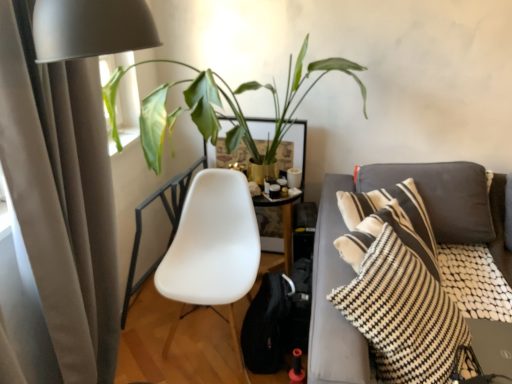
Question: Is beige fabric curtain at left closer to the viewer compared to black and white striped pillow at right?

Choices:
 (A) no
 (B) yes

Answer: (B)

Question: Can you confirm if beige fabric curtain at left is shorter than black and white striped pillow at right?

Choices:
 (A) no
 (B) yes

Answer: (A)

Question: Is beige fabric curtain at left behind black and white striped pillow at right?

Choices:
 (A) no
 (B) yes

Answer: (A)

Question: Is beige fabric curtain at left completely or partially outside of black and white striped pillow at right?

Choices:
 (A) yes
 (B) no

Answer: (A)

Question: From the image's perspective, does beige fabric curtain at left appear higher than black and white striped pillow at right?

Choices:
 (A) no
 (B) yes

Answer: (B)

Question: From a real-world perspective, is beige fabric curtain at left positioned above or below white plastic chair at center?

Choices:
 (A) above
 (B) below

Answer: (A)

Question: Considering the positions of beige fabric curtain at left and white plastic chair at center in the image, is beige fabric curtain at left taller or shorter than white plastic chair at center?

Choices:
 (A) short
 (B) tall

Answer: (B)

Question: Is beige fabric curtain at left wider or thinner than white plastic chair at center?

Choices:
 (A) wide
 (B) thin

Answer: (B)

Question: Is beige fabric curtain at left in front of or behind white plastic chair at center in the image?

Choices:
 (A) behind
 (B) front

Answer: (B)

Question: Is black and white striped pillow at right to the left or to the right of white plastic chair at center in the image?

Choices:
 (A) left
 (B) right

Answer: (B)

Question: Considering the positions of point (421, 347) and point (232, 283), is point (421, 347) closer or farther from the camera than point (232, 283)?

Choices:
 (A) closer
 (B) farther

Answer: (A)

Question: In terms of size, does black and white striped pillow at right appear bigger or smaller than white plastic chair at center?

Choices:
 (A) small
 (B) big

Answer: (A)

Question: Considering the positions of black and white striped pillow at right and white plastic chair at center in the image, is black and white striped pillow at right taller or shorter than white plastic chair at center?

Choices:
 (A) tall
 (B) short

Answer: (B)

Question: Considering the positions of black and white striped pillow at right and green leafy plant at upper left in the image, is black and white striped pillow at right wider or thinner than green leafy plant at upper left?

Choices:
 (A) wide
 (B) thin

Answer: (B)

Question: Considering the relative positions of black and white striped pillow at right and green leafy plant at upper left in the image provided, is black and white striped pillow at right to the left or to the right of green leafy plant at upper left?

Choices:
 (A) right
 (B) left

Answer: (A)